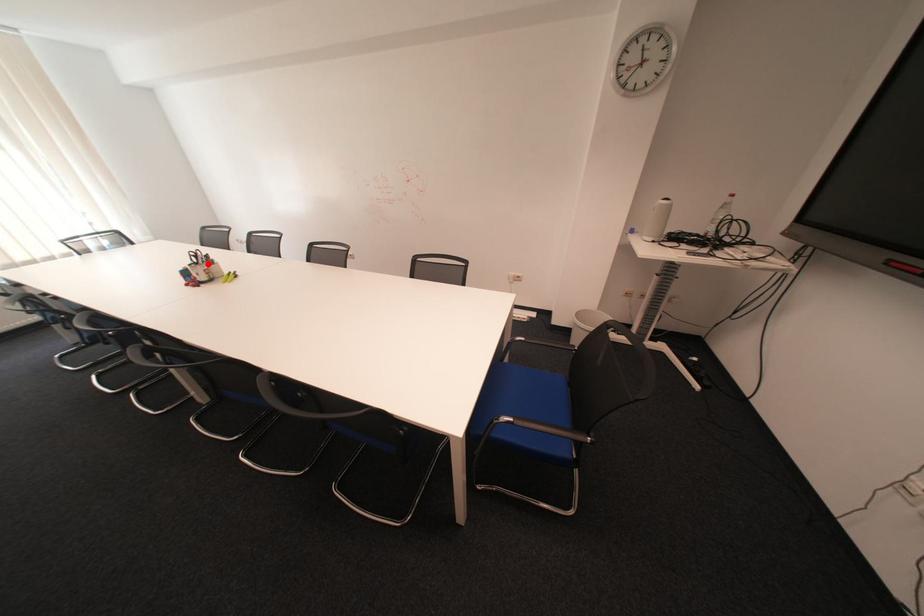
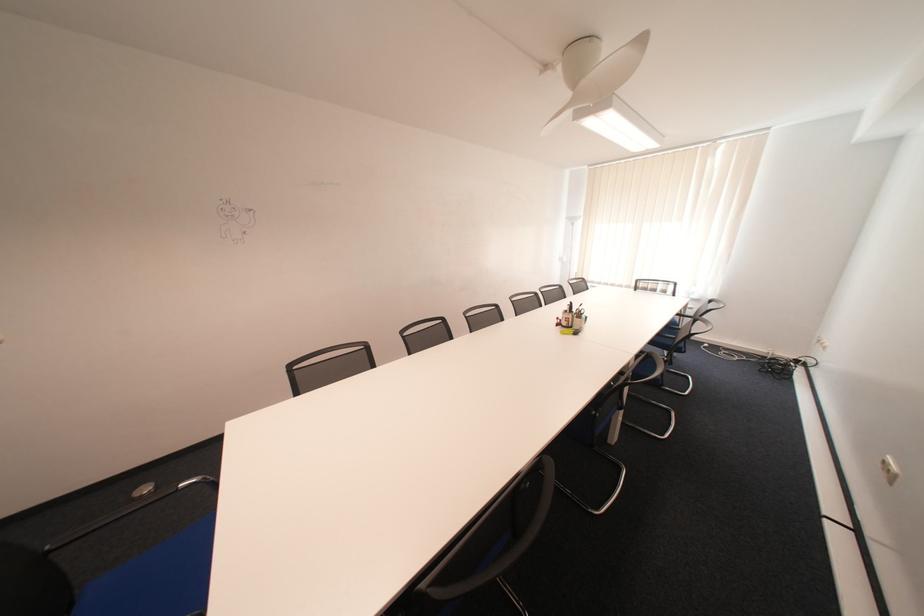
Where in the second image is the point corresponding to the highlighted location from the first image?

(578, 312)